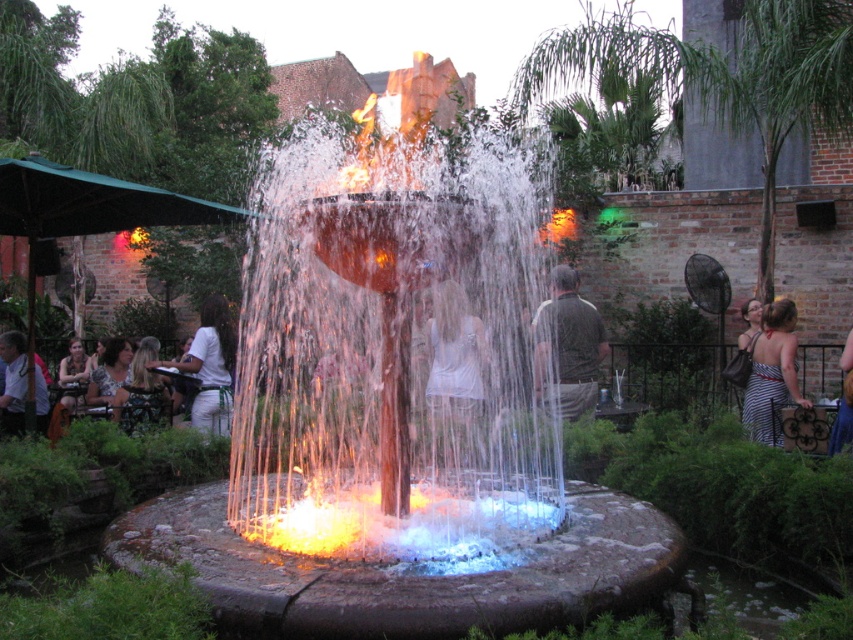
Can you confirm if dark gray shirt at center is positioned to the right of white fabric shirt at left?

Correct, you'll find dark gray shirt at center to the right of white fabric shirt at left.

Which is more to the left, dark gray shirt at center or white fabric shirt at left?

white fabric shirt at left

Between point (593, 378) and point (196, 396), which one is positioned behind?

Point (196, 396)

In order to click on dark gray shirt at center in this screenshot , I will do `click(567, 344)`.

Who is positioned more to the right, glowing orange fire at center or light brown leather jacket at lower left?

glowing orange fire at center is more to the right.

Looking at this image, is glowing orange fire at center taller than light brown leather jacket at lower left?

No.

Which is behind, point (540, 550) or point (39, 422)?

The point (39, 422) is behind.

Where is `glowing orange fire at center`? The image size is (853, 640). glowing orange fire at center is located at coordinates (x=405, y=572).

Between point (312, 480) and point (18, 348), which one is positioned in front?

Positioned in front is point (312, 480).

Does fluorescent orange flames at center have a smaller size compared to light brown leather jacket at lower left?

Correct, fluorescent orange flames at center occupies less space than light brown leather jacket at lower left.

Is point (451, 524) closer to viewer compared to point (42, 432)?

Yes, it is.

Where is `fluorescent orange flames at center`? fluorescent orange flames at center is located at coordinates (398, 520).